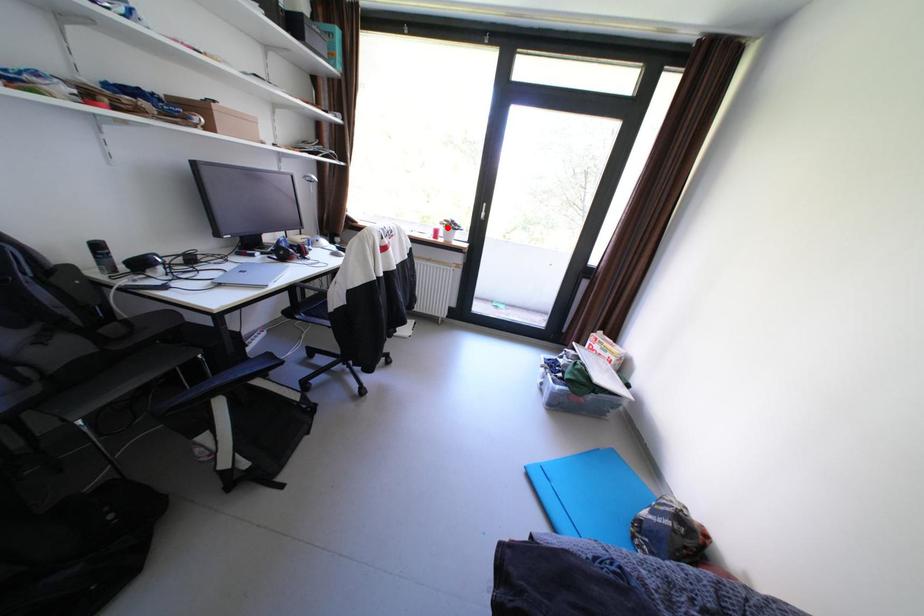
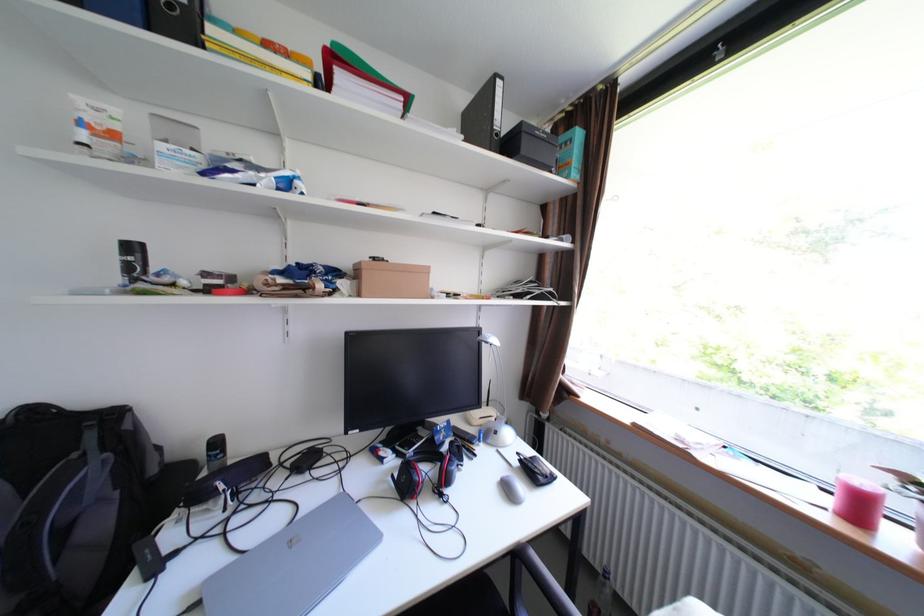
Question: I am providing you with two images of the same scene from different viewpoints. A red point is shown in image1. For the corresponding object point in image2, is it positioned nearer or farther from the camera?

Choices:
 (A) Nearer
 (B) Farther

Answer: (B)